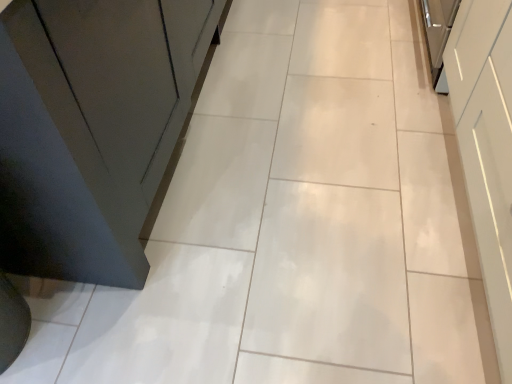
Question: Can you confirm if white glossy cabinet at right is positioned to the right of white glossy drawer at upper right?

Choices:
 (A) no
 (B) yes

Answer: (A)

Question: Are white glossy cabinet at right and white glossy drawer at upper right far apart?

Choices:
 (A) yes
 (B) no

Answer: (B)

Question: Is white glossy cabinet at right next to white glossy drawer at upper right and touching it?

Choices:
 (A) no
 (B) yes

Answer: (A)

Question: From a real-world perspective, is white glossy cabinet at right positioned over white glossy drawer at upper right based on gravity?

Choices:
 (A) no
 (B) yes

Answer: (B)

Question: Is white glossy cabinet at right outside of white glossy drawer at upper right?

Choices:
 (A) yes
 (B) no

Answer: (A)

Question: From a real-world perspective, does white glossy cabinet at right sit lower than white glossy drawer at upper right?

Choices:
 (A) no
 (B) yes

Answer: (A)

Question: Is white glossy drawer at upper right outside white glossy cabinet at right?

Choices:
 (A) yes
 (B) no

Answer: (A)

Question: Considering the relative positions of white glossy drawer at upper right and white glossy cabinet at right in the image provided, is white glossy drawer at upper right behind white glossy cabinet at right?

Choices:
 (A) yes
 (B) no

Answer: (A)

Question: Is white glossy drawer at upper right smaller than white glossy cabinet at right?

Choices:
 (A) yes
 (B) no

Answer: (A)

Question: From a real-world perspective, is white glossy drawer at upper right under white glossy cabinet at right?

Choices:
 (A) no
 (B) yes

Answer: (B)

Question: Would you say white glossy drawer at upper right contains white glossy cabinet at right?

Choices:
 (A) no
 (B) yes

Answer: (A)

Question: Is white glossy drawer at upper right shorter than white glossy cabinet at right?

Choices:
 (A) yes
 (B) no

Answer: (A)

Question: Considering the relative positions of white glossy drawer at upper right and white glossy cabinet at right in the image provided, is white glossy drawer at upper right to the left or to the right of white glossy cabinet at right?

Choices:
 (A) right
 (B) left

Answer: (A)